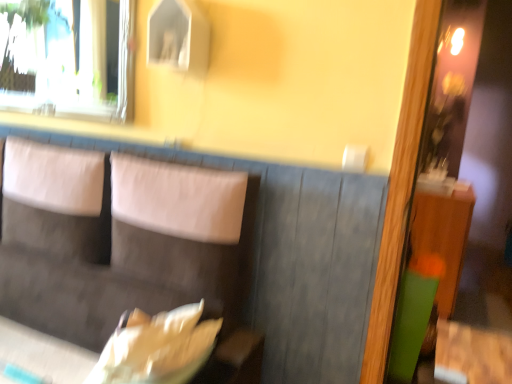
Question: Considering the positions of point (121, 119) and point (147, 235), is point (121, 119) closer or farther from the camera than point (147, 235)?

Choices:
 (A) farther
 (B) closer

Answer: (A)

Question: Considering their positions, is transparent glass window at upper left located in front of or behind suede-like gray couch at center?

Choices:
 (A) behind
 (B) front

Answer: (A)

Question: From a real-world perspective, is transparent glass window at upper left physically located above or below suede-like gray couch at center?

Choices:
 (A) below
 (B) above

Answer: (B)

Question: From the image's perspective, relative to transparent glass window at upper left, is suede-like gray couch at center above or below?

Choices:
 (A) below
 (B) above

Answer: (A)

Question: Looking at their shapes, would you say suede-like gray couch at center is wider or thinner than transparent glass window at upper left?

Choices:
 (A) thin
 (B) wide

Answer: (B)

Question: Considering the positions of suede-like gray couch at center and transparent glass window at upper left in the image, is suede-like gray couch at center bigger or smaller than transparent glass window at upper left?

Choices:
 (A) small
 (B) big

Answer: (B)

Question: Does point (49, 278) appear closer or farther from the camera than point (68, 41)?

Choices:
 (A) closer
 (B) farther

Answer: (A)